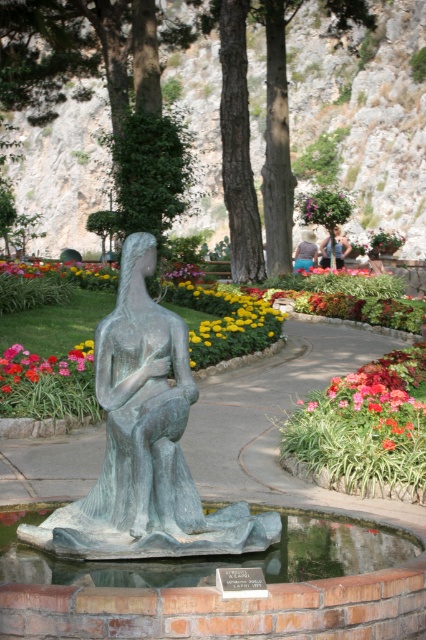
Looking at this image, you are standing in the garden and want to take a photo of the yellowfloralflower at center. Where should you position yourself to capture it in the frame?

The yellowfloralflower at center is located at coordinates (63,272), so you should position yourself directly in front of it to capture it in the frame.